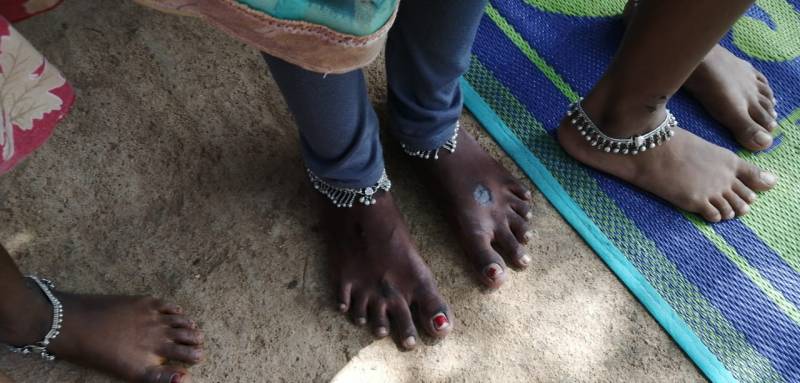
The image size is (800, 383). I want to click on concrete floor, so click(x=205, y=232).